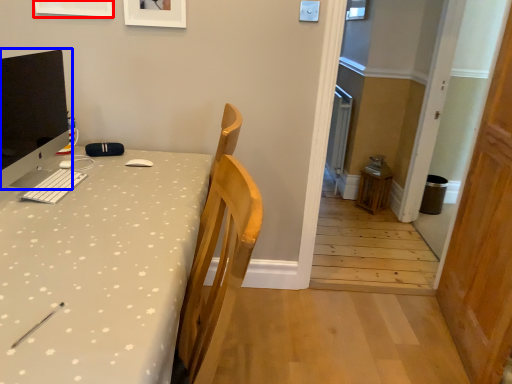
Question: Which of the following is the closest to the observer, picture frame (highlighted by a red box) or computer monitor (highlighted by a blue box)?

Choices:
 (A) picture frame
 (B) computer monitor

Answer: (B)